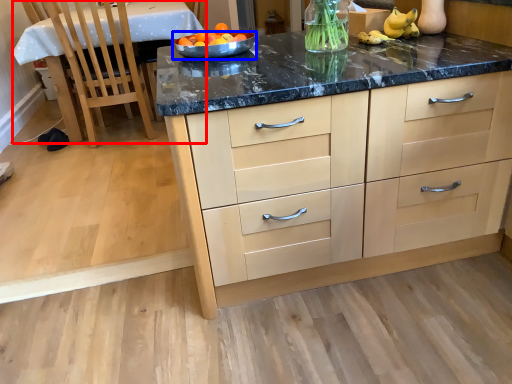
Question: Which object appears farthest to the camera in this image, table (highlighted by a red box) or bowl (highlighted by a blue box)?

Choices:
 (A) table
 (B) bowl

Answer: (A)